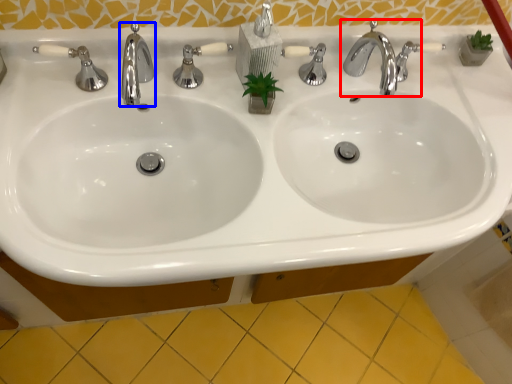
Question: Which object is further to the camera taking this photo, tap (highlighted by a red box) or tap (highlighted by a blue box)?

Choices:
 (A) tap
 (B) tap

Answer: (A)